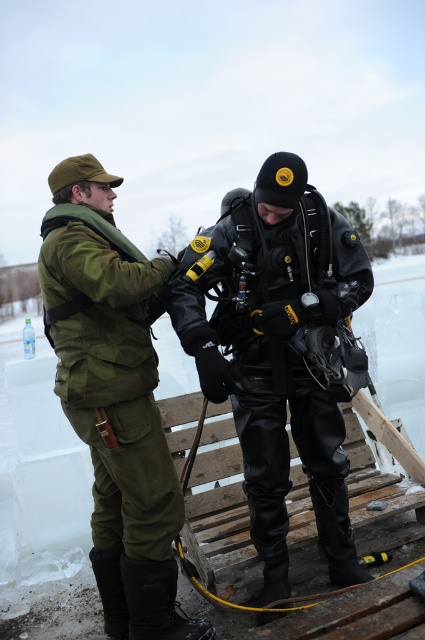
Question: Which point is closer to the camera?

Choices:
 (A) (183, 339)
 (B) (150, 556)

Answer: (B)

Question: In this image, where is black leather diving suit at center located relative to green matte uniform at left?

Choices:
 (A) right
 (B) left

Answer: (A)

Question: Can you confirm if black leather diving suit at center is positioned below green matte uniform at left?

Choices:
 (A) yes
 (B) no

Answer: (B)

Question: Can you confirm if black leather diving suit at center is positioned above green matte uniform at left?

Choices:
 (A) yes
 (B) no

Answer: (A)

Question: Which point appears farthest from the camera in this image?

Choices:
 (A) (121, 460)
 (B) (280, 536)

Answer: (B)